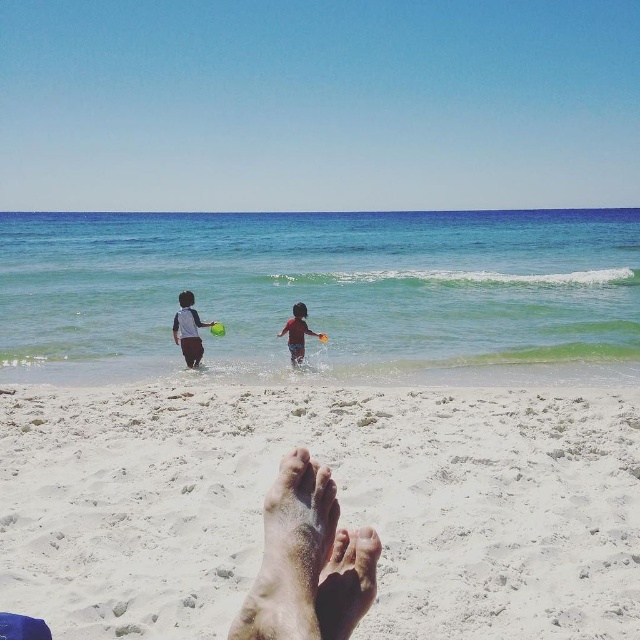
Question: Which object appears closest to the camera in this image?

Choices:
 (A) dry sand foot at lower center
 (B) red matte swimsuit at center
 (C) clear blue water at center
 (D) white matte shirt at left

Answer: (A)

Question: Does dry skin foot at lower center have a greater width compared to white matte shirt at left?

Choices:
 (A) yes
 (B) no

Answer: (B)

Question: Observing the image, what is the correct spatial positioning of white sandy feet at lower center in reference to dry skin foot at lower center?

Choices:
 (A) right
 (B) left

Answer: (B)

Question: Is clear blue water at center to the left of dry skin foot at lower center from the viewer's perspective?

Choices:
 (A) no
 (B) yes

Answer: (B)

Question: Based on their relative distances, which object is nearer to the white sandy feet at lower center?

Choices:
 (A) dry sand foot at lower center
 (B) clear blue water at center
 (C) dry skin foot at lower center
 (D) red matte swimsuit at center

Answer: (C)

Question: Among these points, which one is farthest from the camera?

Choices:
 (A) (305, 323)
 (B) (577, 412)
 (C) (403, 330)
 (D) (301, 595)

Answer: (C)